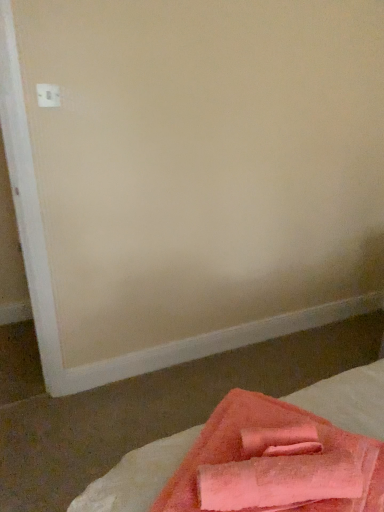
This screenshot has height=512, width=384. What are the coordinates of `white plastic electric outlet at upper left` in the screenshot? It's located at (48, 95).

Describe the element at coordinates (136, 476) in the screenshot. I see `soft pink towel at lower right` at that location.

Identify the location of pink terry cloth towel at lower right. (288, 471).

From the picture: Does pink terry cloth towel at lower right appear on the left side of soft pink towel at lower right?

Indeed, pink terry cloth towel at lower right is positioned on the left side of soft pink towel at lower right.

Is pink terry cloth towel at lower right thinner than soft pink towel at lower right?

Correct, the width of pink terry cloth towel at lower right is less than that of soft pink towel at lower right.

Is point (312, 430) closer or farther from the camera than point (94, 508)?

Point (312, 430) is closer to the camera than point (94, 508).

Is pink terry cloth towel at lower right next to soft pink towel at lower right and touching it?

There is a gap between pink terry cloth towel at lower right and soft pink towel at lower right.

In the scene shown: From a real-world perspective, does soft pink towel at lower right stand above white plastic electric outlet at upper left?

No, from a real-world perspective, soft pink towel at lower right is not above white plastic electric outlet at upper left.

Is soft pink towel at lower right inside or outside of white plastic electric outlet at upper left?

soft pink towel at lower right is not enclosed by white plastic electric outlet at upper left.

Can you tell me how much soft pink towel at lower right and white plastic electric outlet at upper left differ in facing direction?

142 degrees separate the facing orientations of soft pink towel at lower right and white plastic electric outlet at upper left.

Can you confirm if soft pink towel at lower right is thinner than white plastic electric outlet at upper left?

No.

From a real-world perspective, is white plastic electric outlet at upper left positioned under pink terry cloth towel at lower right based on gravity?

Incorrect, from a real-world perspective, white plastic electric outlet at upper left is higher than pink terry cloth towel at lower right.

Which object is wider, white plastic electric outlet at upper left or pink terry cloth towel at lower right?

A: With larger width is pink terry cloth towel at lower right.

Between point (50, 104) and point (261, 504), which one is positioned in front?

Positioned in front is point (261, 504).

Between white plastic electric outlet at upper left and soft pink towel at lower right, which one appears on the right side from the viewer's perspective?

soft pink towel at lower right is more to the right.

Can you confirm if white plastic electric outlet at upper left is shorter than soft pink towel at lower right?

Yes.

Is white plastic electric outlet at upper left facing towards soft pink towel at lower right?

No, white plastic electric outlet at upper left is not oriented towards soft pink towel at lower right.

How many degrees apart are the facing directions of white plastic electric outlet at upper left and soft pink towel at lower right?

They differ by 142 degrees in their facing directions.

This screenshot has height=512, width=384. Find the location of `electric outlet behind the pink terry cloth towel at lower right`. electric outlet behind the pink terry cloth towel at lower right is located at coordinates (48, 95).

Can you tell me how much pink terry cloth towel at lower right and white plastic electric outlet at upper left differ in facing direction?

There is a 107-degree angle between the facing directions of pink terry cloth towel at lower right and white plastic electric outlet at upper left.

Is pink terry cloth towel at lower right aimed at white plastic electric outlet at upper left?

No, pink terry cloth towel at lower right is not turned towards white plastic electric outlet at upper left.

Are pink terry cloth towel at lower right and white plastic electric outlet at upper left beside each other?

No, pink terry cloth towel at lower right is not next to white plastic electric outlet at upper left.

From the image's perspective, relative to pink terry cloth towel at lower right, is soft pink towel at lower right above or below?

soft pink towel at lower right is below pink terry cloth towel at lower right.

Is soft pink towel at lower right wider or thinner than pink terry cloth towel at lower right?

Considering their sizes, soft pink towel at lower right looks broader than pink terry cloth towel at lower right.

Is soft pink towel at lower right next to pink terry cloth towel at lower right and touching it?

No, soft pink towel at lower right is not beside pink terry cloth towel at lower right.

Considering the points (374, 400) and (263, 437), which point is in front, point (374, 400) or point (263, 437)?

Positioned in front is point (263, 437).

You are a GUI agent. You are given a task and a screenshot of the screen. Output one action in this format:
    pyautogui.click(x=<x>, y=<y>)
    Task: Click on the bed that appears below the pink terry cloth towel at lower right (from a real-world perspective)
    
    Given the screenshot: What is the action you would take?
    pyautogui.click(x=136, y=476)

Identify the location of bed below the white plastic electric outlet at upper left (from the image's perspective). Image resolution: width=384 pixels, height=512 pixels. (136, 476).

Estimate the real-world distances between objects in this image. Which object is closer to white plastic electric outlet at upper left, pink terry cloth towel at lower right or soft pink towel at lower right?

Based on the image, soft pink towel at lower right appears to be nearer to white plastic electric outlet at upper left.

Considering their positions, is white plastic electric outlet at upper left positioned further to soft pink towel at lower right than pink terry cloth towel at lower right?

The object further to soft pink towel at lower right is white plastic electric outlet at upper left.

Estimate the real-world distances between objects in this image. Which object is further from pink terry cloth towel at lower right, soft pink towel at lower right or white plastic electric outlet at upper left?

The object further to pink terry cloth towel at lower right is white plastic electric outlet at upper left.

From the image, which object appears to be nearer to white plastic electric outlet at upper left, soft pink towel at lower right or pink terry cloth towel at lower right?

Among the two, soft pink towel at lower right is located nearer to white plastic electric outlet at upper left.

Estimate the real-world distances between objects in this image. Which object is closer to pink terry cloth towel at lower right, white plastic electric outlet at upper left or soft pink towel at lower right?

Based on the image, soft pink towel at lower right appears to be nearer to pink terry cloth towel at lower right.

Considering their positions, is pink terry cloth towel at lower right positioned further to soft pink towel at lower right than white plastic electric outlet at upper left?

white plastic electric outlet at upper left lies further to soft pink towel at lower right than the other object.

Where is `bath towel between white plastic electric outlet at upper left and soft pink towel at lower right from top to bottom`? bath towel between white plastic electric outlet at upper left and soft pink towel at lower right from top to bottom is located at coordinates (288, 471).